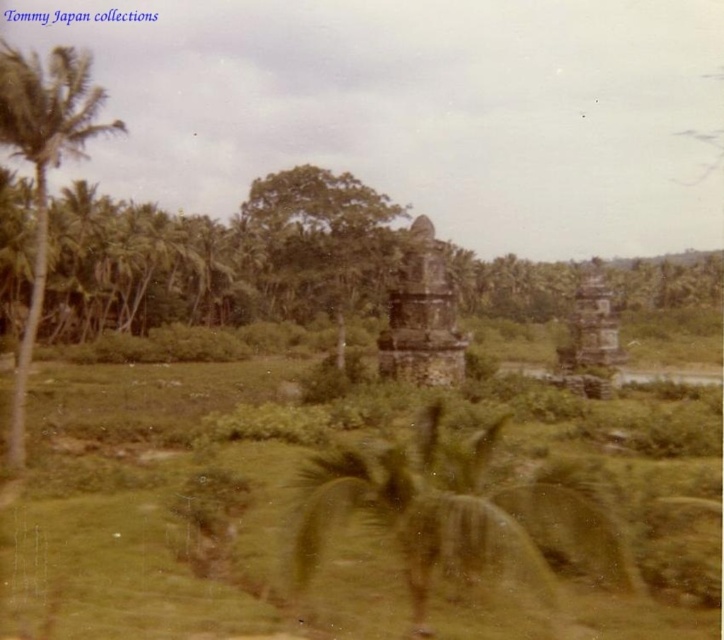
Is point (295, 570) positioned behind point (41, 76)?

No, it is in front of (41, 76).

This screenshot has width=724, height=640. In order to click on green leafy palm tree at center in this screenshot , I will do `click(460, 516)`.

Does point (387, 500) lie in front of point (85, 100)?

Yes.

Locate an element on the screen. green leafy palm tree at center is located at coordinates (460, 516).

Does green leafy palm tree at left appear over dark brown stone temple at center?

Correct, green leafy palm tree at left is located above dark brown stone temple at center.

Who is more forward, (62,72) or (455,353)?

Point (62,72) is in front.

From the picture: Measure the distance between green leafy palm tree at left and camera.

green leafy palm tree at left is 20.00 meters from camera.

At what (x,y) coordinates should I click in order to perform the action: click on green leafy palm tree at left. Please return your answer as a coordinate pair (x, y). This screenshot has width=724, height=640. Looking at the image, I should click on (43, 168).

Can you confirm if green leafy palm tree at center is positioned to the right of dark brown stone temple at center?

Incorrect, green leafy palm tree at center is not on the right side of dark brown stone temple at center.

Does green leafy palm tree at center have a lesser width compared to dark brown stone temple at center?

No, green leafy palm tree at center is not thinner than dark brown stone temple at center.

Does point (557, 608) lie in front of point (397, 312)?

Yes, point (557, 608) is closer to viewer.

The width and height of the screenshot is (724, 640). Identify the location of green leafy palm tree at center. pyautogui.click(x=460, y=516).